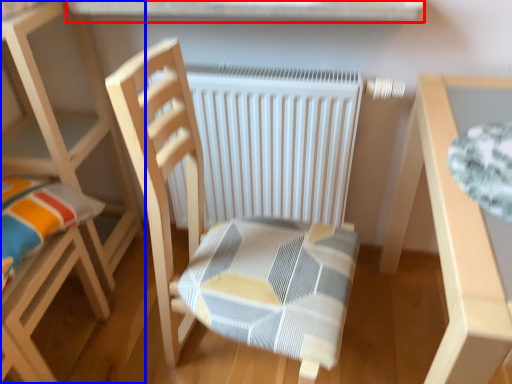
Question: Which of the following is the farthest to the observer, window sill (highlighted by a red box) or chair (highlighted by a blue box)?

Choices:
 (A) window sill
 (B) chair

Answer: (B)